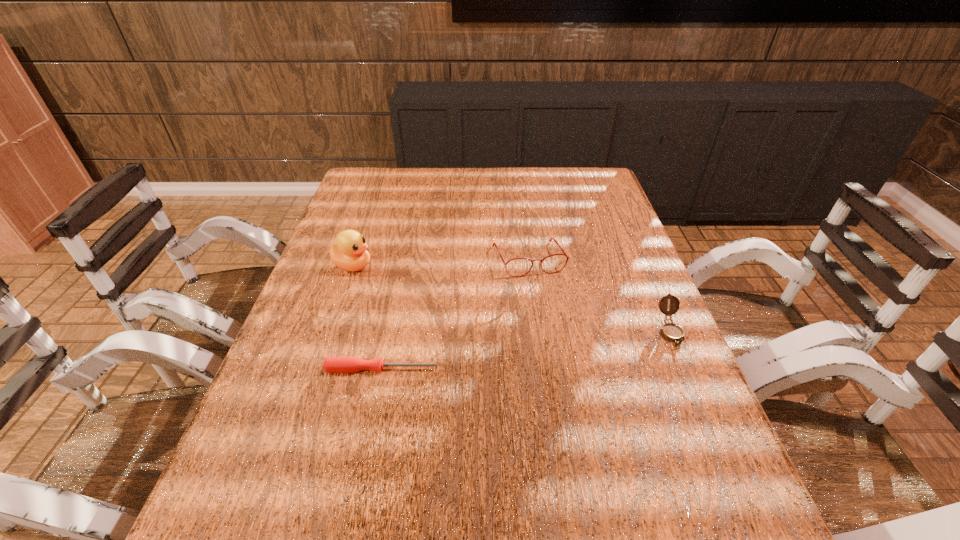
Identify the location of vacant region located on the face of the second object from right to left. (546, 299).

At what (x,y) coordinates should I click in order to perform the action: click on free space located 0.290m on the face of the tallest object. Please return your answer as a coordinate pair (x, y). This screenshot has height=540, width=960. Looking at the image, I should click on (464, 303).

Where is `free location located 0.330m on the face of the tallest object`? The width and height of the screenshot is (960, 540). free location located 0.330m on the face of the tallest object is located at coordinates (477, 308).

Identify the location of vacant space positioned 0.230m on the face of the tallest object. [x=443, y=296].

The image size is (960, 540). Find the location of `screwdriver present at the left edge`. screwdriver present at the left edge is located at coordinates (331, 364).

Find the location of a particular element. duckling situated at the left edge is located at coordinates (350, 253).

In order to click on object that is at the right edge in this screenshot , I will do `click(672, 332)`.

The width and height of the screenshot is (960, 540). I want to click on blank space at the far edge of the desktop, so click(509, 197).

Find the location of a particular element. This screenshot has width=960, height=540. free space at the near edge of the desktop is located at coordinates (428, 450).

Where is `free space at the left edge`? This screenshot has height=540, width=960. free space at the left edge is located at coordinates (348, 208).